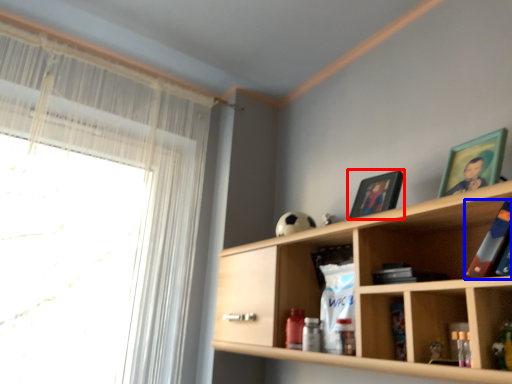
Question: Which point is further to the camera, picture frame (highlighted by a red box) or book (highlighted by a blue box)?

Choices:
 (A) picture frame
 (B) book

Answer: (A)